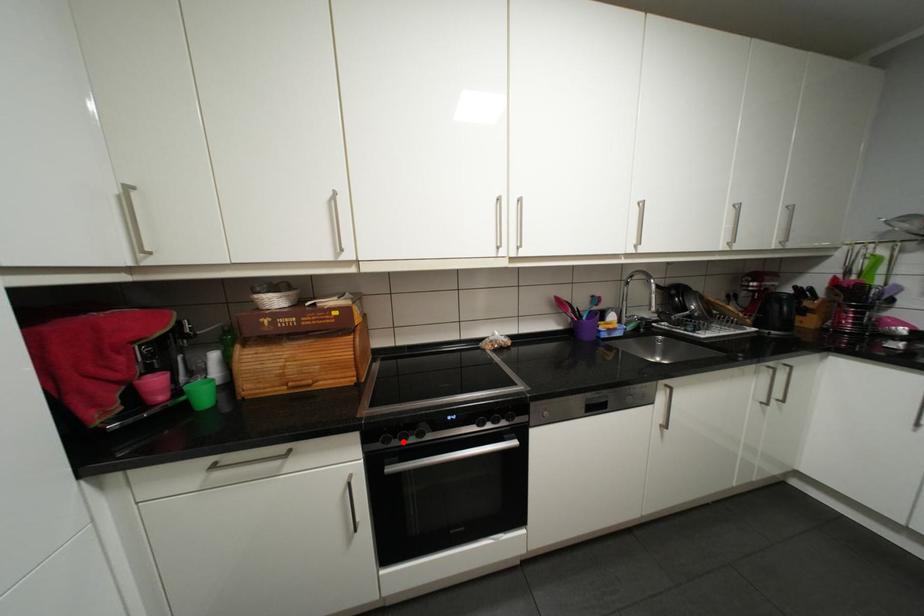
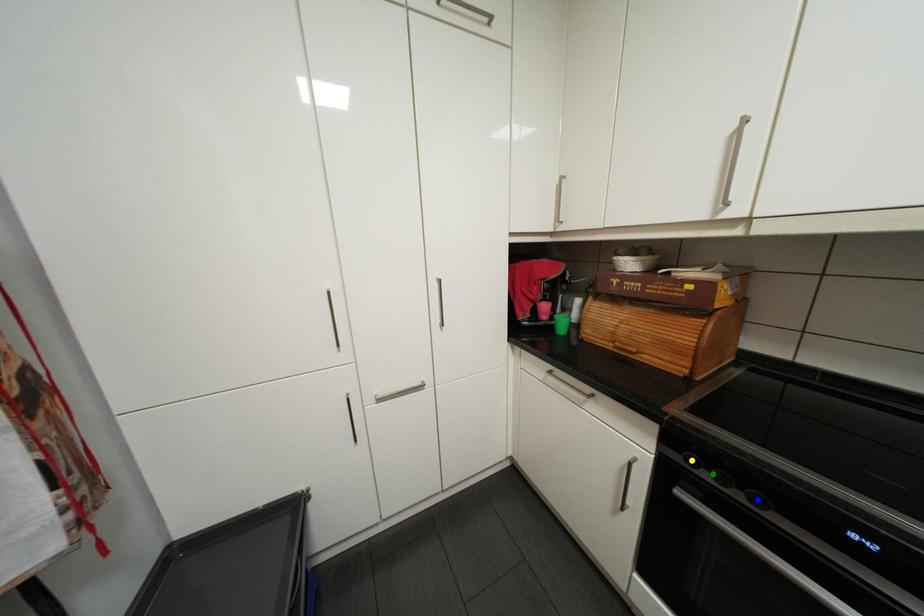
Question: I am providing you with two images of the same scene from different viewpoints. A red point is marked on the first image. You are given multiple points on the second image. Which point in image 2 is actually the same real-world point as the red point in image 1?

Choices:
 (A) yellow point
 (B) green point
 (C) blue point

Answer: (B)